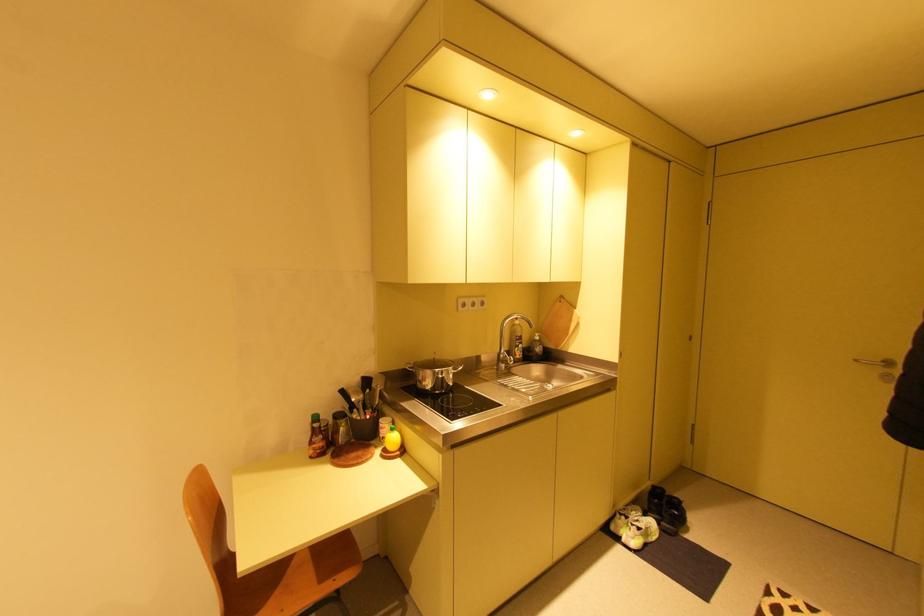
Where is `wooden cutting board`? The image size is (924, 616). wooden cutting board is located at coordinates (558, 323).